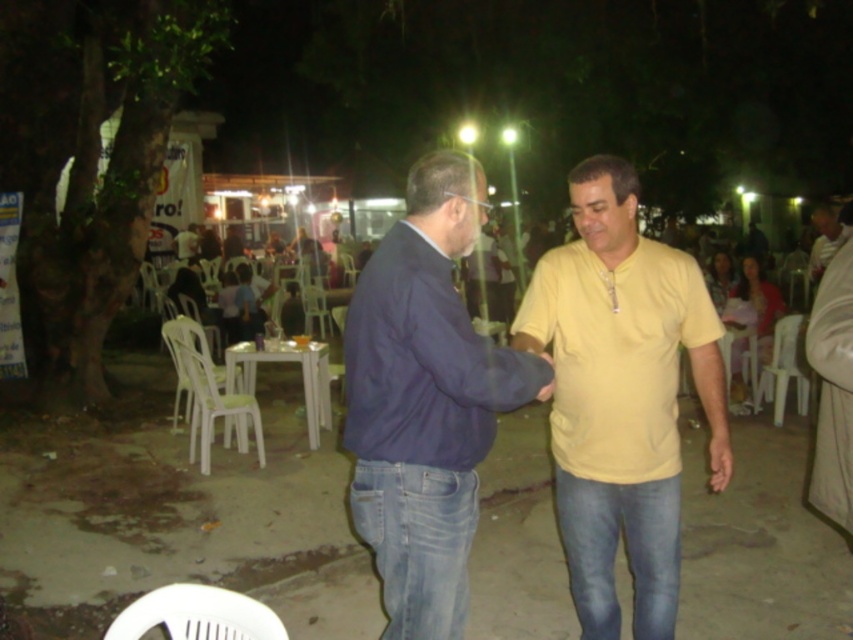
Between yellow matte shirt at center and dark blue cotton shirt at center, which one appears on the left side from the viewer's perspective?

dark blue cotton shirt at center

Image resolution: width=853 pixels, height=640 pixels. In order to click on yellow matte shirt at center in this screenshot , I will do `click(621, 396)`.

Is point (677, 289) farther from camera compared to point (404, 540)?

Yes, point (677, 289) is behind point (404, 540).

You are a GUI agent. You are given a task and a screenshot of the screen. Output one action in this format:
    pyautogui.click(x=<x>, y=<y>)
    Task: Click on the yellow matte shirt at center
    This screenshot has height=640, width=853.
    Given the screenshot: What is the action you would take?
    pyautogui.click(x=621, y=396)